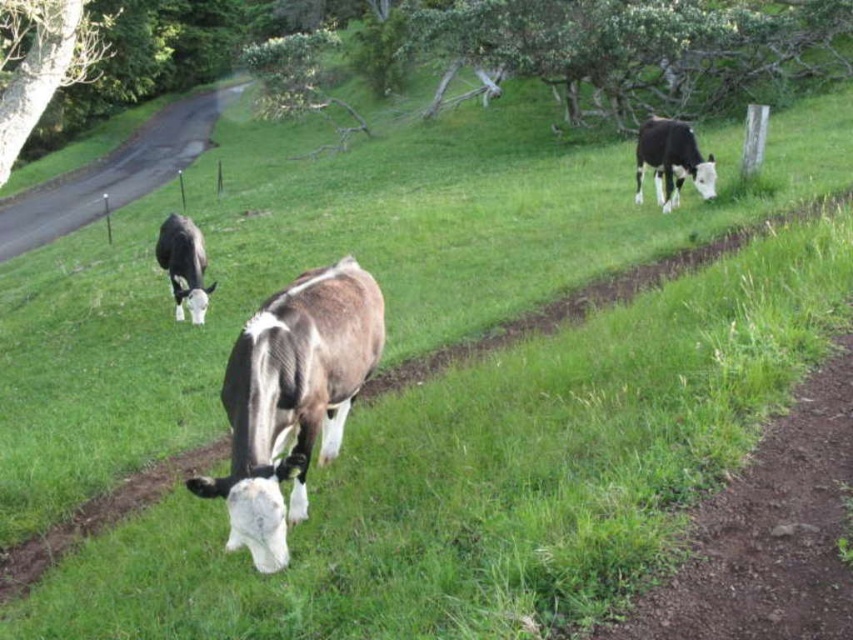
Find the location of a particular element. The height and width of the screenshot is (640, 853). white and black cow at upper right is located at coordinates (671, 161).

Is white and black cow at upper right below white and brown cow at center?

Incorrect, white and black cow at upper right is not positioned below white and brown cow at center.

Locate an element on the screen. white and black cow at upper right is located at coordinates (671, 161).

Is point (79, 192) positioned behind point (639, 160)?

Yes.

What do you see at coordinates (113, 173) in the screenshot? This screenshot has height=640, width=853. I see `asphalt road at left` at bounding box center [113, 173].

Locate an element on the screen. This screenshot has height=640, width=853. asphalt road at left is located at coordinates (113, 173).

Which is behind, point (372, 356) or point (28, 192)?

Positioned behind is point (28, 192).

Does point (276, 499) come farther from viewer compared to point (71, 186)?

No.

Find the location of a particular element. The height and width of the screenshot is (640, 853). brown glossy cow at center is located at coordinates (291, 397).

Locate an element on the screen. brown glossy cow at center is located at coordinates (291, 397).